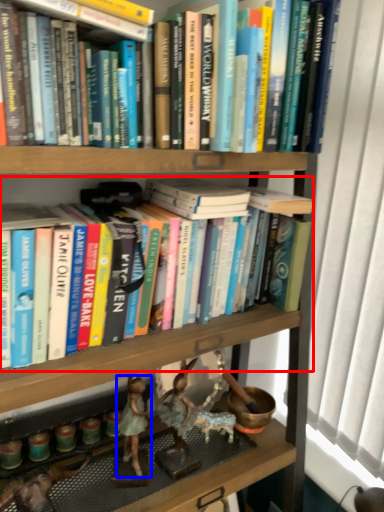
Question: Which point is closer to the camera, book (highlighted by a red box) or person (highlighted by a blue box)?

Choices:
 (A) book
 (B) person

Answer: (A)